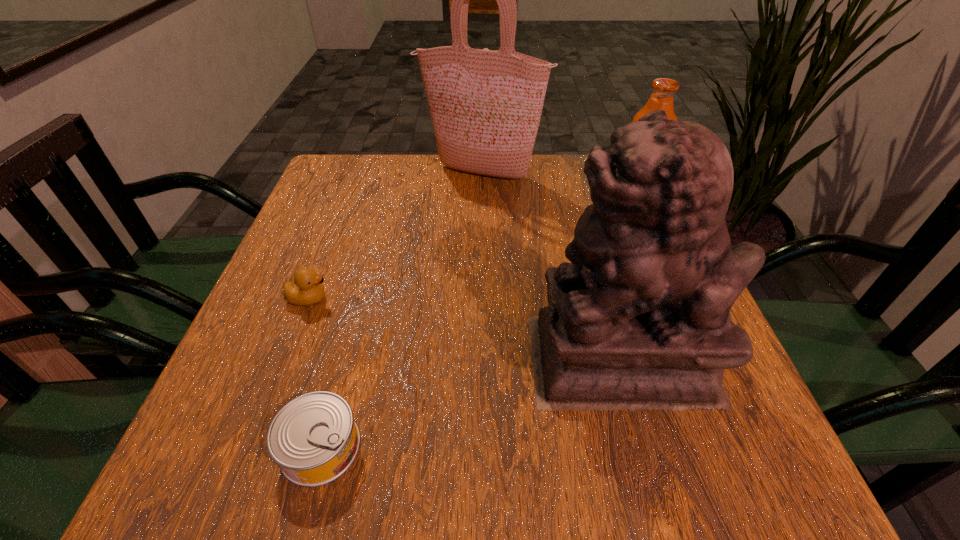
Locate an element on the screen. free space between the fruit juice and the farthest object is located at coordinates 557,188.

This screenshot has height=540, width=960. I want to click on object that ranks as the fourth closest to the sculpture, so click(x=485, y=105).

The width and height of the screenshot is (960, 540). Find the location of `object that can be found as the third closest to the duckling`. object that can be found as the third closest to the duckling is located at coordinates (485, 105).

Find the location of a particular element. This screenshot has height=540, width=960. free space in the image that satisfies the following two spatial constraints: 1. on the label side of the third shortest object; 2. on the front side of the second object from left to right is located at coordinates (739, 447).

At what (x,y) coordinates should I click in order to perform the action: click on vacant area that satisfies the following two spatial constraints: 1. on the back side of the fourth object from right to left; 2. on the left side of the shopping bag. Please return your answer as a coordinate pair (x, y). This screenshot has height=540, width=960. Looking at the image, I should click on (394, 173).